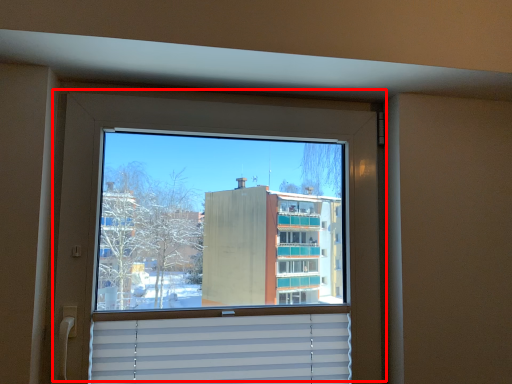
Question: Considering the relative positions of window (annotated by the red box) and shutter in the image provided, where is window (annotated by the red box) located with respect to the staircase?

Choices:
 (A) right
 (B) left

Answer: (A)